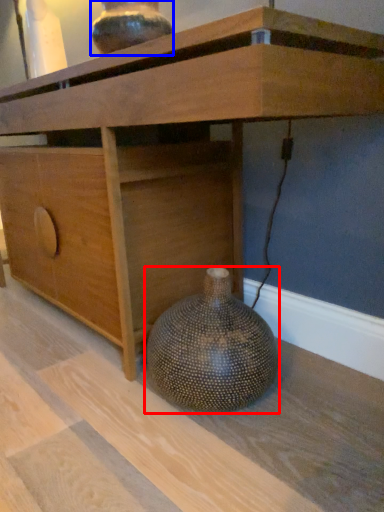
Question: Among these objects, which one is nearest to the camera, vase (highlighted by a red box) or vase (highlighted by a blue box)?

Choices:
 (A) vase
 (B) vase

Answer: (A)